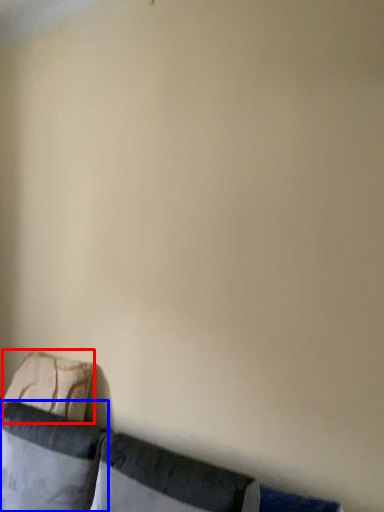
Question: Which object appears closest to the camera in this image, pillow (highlighted by a red box) or pillow (highlighted by a blue box)?

Choices:
 (A) pillow
 (B) pillow

Answer: (B)